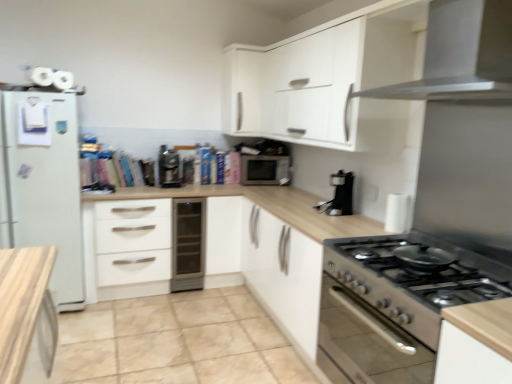
This screenshot has height=384, width=512. I want to click on vacant space in front of white matte drawer at center, so click(121, 319).